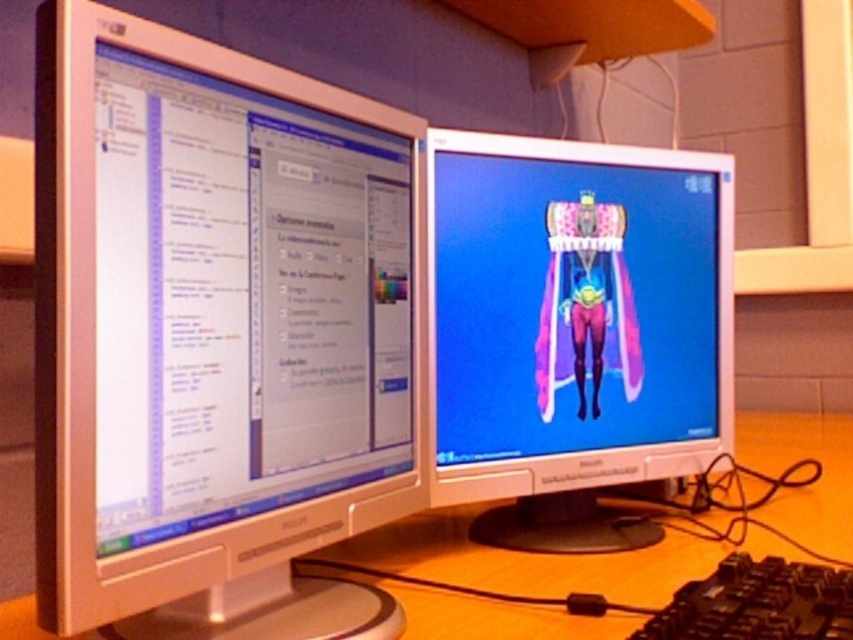
Is matte white monitor at left smaller than wooden at center?

Yes, matte white monitor at left is smaller than wooden at center.

Between matte white monitor at left and wooden at center, which one has less height?

With less height is wooden at center.

Is point (300, 506) closer to viewer compared to point (781, 468)?

Yes, it is in front of point (781, 468).

Identify the location of matte white monitor at left. (213, 333).

Does wooden at center have a larger size compared to black plastic keyboard at lower right?

Yes, wooden at center is bigger than black plastic keyboard at lower right.

Which is above, wooden at center or black plastic keyboard at lower right?

black plastic keyboard at lower right is higher up.

Which is behind, point (500, 632) or point (821, 570)?

Point (821, 570)

Where is `wooden at center`? wooden at center is located at coordinates (527, 561).

Does matte white monitor at left have a lesser width compared to black plastic keyboard at lower right?

Yes, matte white monitor at left is thinner than black plastic keyboard at lower right.

Who is taller, matte white monitor at left or black plastic keyboard at lower right?

With more height is matte white monitor at left.

Find the location of `matte white monitor at left`. matte white monitor at left is located at coordinates (213, 333).